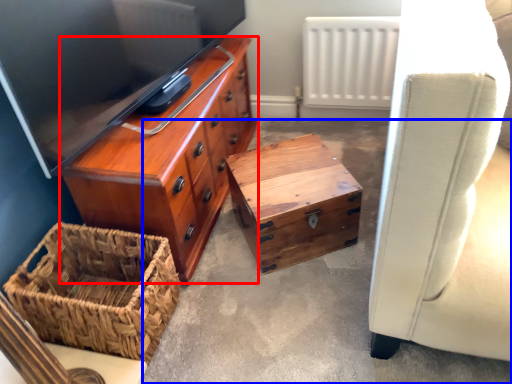
Question: Which object appears farthest to the camera in this image, chest of drawers (highlighted by a red box) or concrete (highlighted by a blue box)?

Choices:
 (A) chest of drawers
 (B) concrete

Answer: (A)